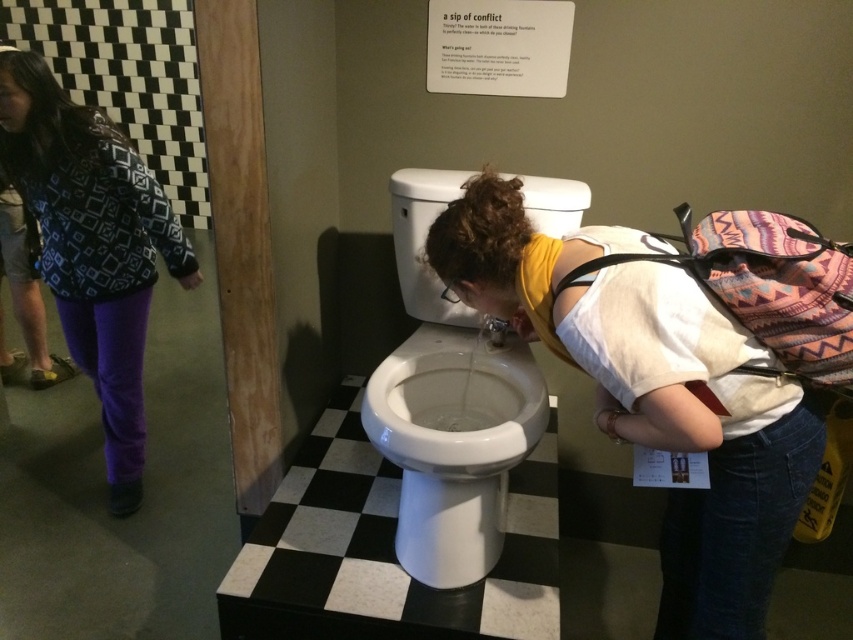
You are standing in the museum exhibit and want to take a photo of both the white toilet and the colorful backpack. To ensure both are in frame, should you position yourself closer to point (419, 365) or point (199, 275)?

You should position yourself closer to point (199, 275) because point (419, 365) is in front of it, so moving closer to the back point would allow both objects to be in the frame.

You are an interior designer assessing the layout of this exhibit. You notice the white glossy toilet at center and the patterned fabric jacket at left. Based on their sizes, which object would require more floor space if placed in a smaller room?

The patterned fabric jacket at left requires more floor space because it is larger than the white glossy toilet at center.

You are a security guard at the museum and notice the white glossy toilet at center and the patterned fabric jacket at left. Which object is positioned lower in the image?

The white glossy toilet at center is located below the patterned fabric jacket at left, so it is positioned lower in the image.